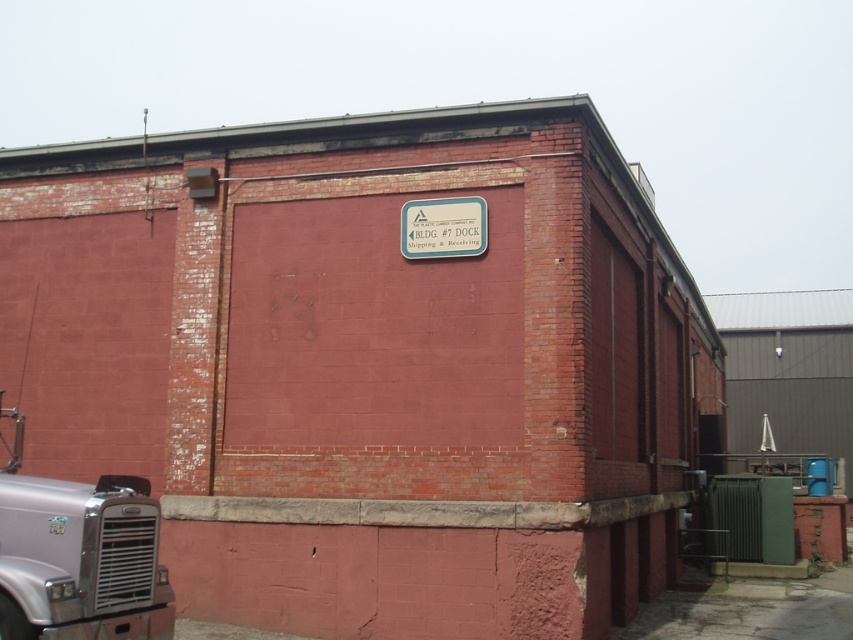
You are standing in front of the red brick building and want to walk towards the two points marked on the wall. Which point, point (154, 611) or point (457, 211), will you encounter first?

Point (154, 611) is in front of point (457, 211), so you will encounter point (154, 611) first.

You are a delivery driver who needs to park your silver metallic truck at lower left near the metallic blue sign at center. Can you park the truck without blocking the sign?

The silver metallic truck at lower left is already in front of the metallic blue sign at center, so parking it there would block the sign. Choose another spot further away from the sign to ensure it remains visible.

You are standing at the entrance of BLDG. 7 and need to locate the dock area. There is a silver metallic truck at lower left represented by point [79,563]. Based on the scene description, where should you go to find the dock?

The silver metallic truck at lower left represented by point [79,563] is located at the dock area, so you should go to where the truck is parked to find the dock.